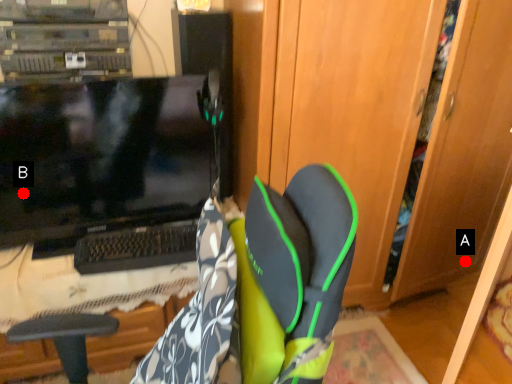
Question: Two points are circled on the image, labeled by A and B beside each circle. Which point is farther to the camera?

Choices:
 (A) A is further
 (B) B is further

Answer: (A)